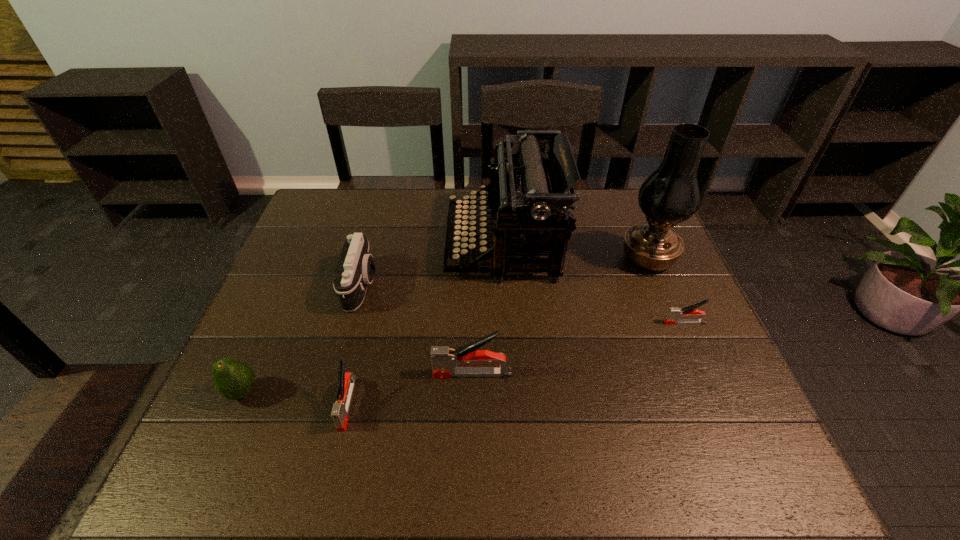
Identify the location of the second shortest stapler. This screenshot has width=960, height=540. (346, 381).

Where is `the tallest stapler`? the tallest stapler is located at coordinates (444, 360).

Locate an element on the screen. This screenshot has height=540, width=960. the fourth farthest object is located at coordinates (674, 313).

Where is `the farthest stapler`? Image resolution: width=960 pixels, height=540 pixels. the farthest stapler is located at coordinates (674, 313).

The height and width of the screenshot is (540, 960). I want to click on the sixth shortest object, so (x=527, y=196).

This screenshot has height=540, width=960. Identify the location of oil lamp. (671, 195).

Where is `camera`? The width and height of the screenshot is (960, 540). camera is located at coordinates (355, 269).

You are a GUI agent. You are given a task and a screenshot of the screen. Output one action in this format:
    pyautogui.click(x=<x>, y=<y>)
    Task: Click on the avocado
    The height and width of the screenshot is (540, 960).
    Given the screenshot: What is the action you would take?
    pyautogui.click(x=234, y=379)

Identify the location of free space located on the handle side of the tallest stapler. The height and width of the screenshot is (540, 960). (389, 374).

Locate an element on the screen. free space located on the handle side of the tallest stapler is located at coordinates (296, 374).